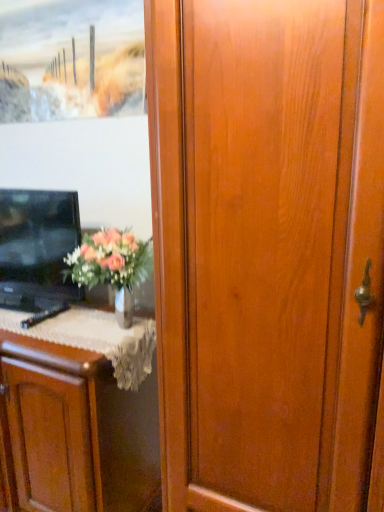
Question: Are matte wood cabinet at left and wooden frame at upper left far apart?

Choices:
 (A) yes
 (B) no

Answer: (A)

Question: Is matte wood cabinet at left to the right of wooden frame at upper left from the viewer's perspective?

Choices:
 (A) yes
 (B) no

Answer: (B)

Question: From the image's perspective, would you say matte wood cabinet at left is positioned over wooden frame at upper left?

Choices:
 (A) yes
 (B) no

Answer: (B)

Question: Does matte wood cabinet at left turn towards wooden frame at upper left?

Choices:
 (A) no
 (B) yes

Answer: (A)

Question: Is matte wood cabinet at left looking in the opposite direction of wooden frame at upper left?

Choices:
 (A) no
 (B) yes

Answer: (A)

Question: From a real-world perspective, is matte wood cabinet at left over wooden frame at upper left?

Choices:
 (A) no
 (B) yes

Answer: (A)

Question: Considering the relative sizes of black glossy tv at left and wooden frame at upper left in the image provided, is black glossy tv at left taller than wooden frame at upper left?

Choices:
 (A) no
 (B) yes

Answer: (B)

Question: Is black glossy tv at left thinner than wooden frame at upper left?

Choices:
 (A) no
 (B) yes

Answer: (A)

Question: Is black glossy tv at left next to wooden frame at upper left and touching it?

Choices:
 (A) no
 (B) yes

Answer: (A)

Question: Does black glossy tv at left have a greater width compared to wooden frame at upper left?

Choices:
 (A) no
 (B) yes

Answer: (B)

Question: Considering the relative sizes of black glossy tv at left and wooden frame at upper left in the image provided, is black glossy tv at left bigger than wooden frame at upper left?

Choices:
 (A) yes
 (B) no

Answer: (A)

Question: Is black glossy tv at left to the right of wooden frame at upper left from the viewer's perspective?

Choices:
 (A) yes
 (B) no

Answer: (B)

Question: From a real-world perspective, is wooden frame at upper left below black glossy tv at left?

Choices:
 (A) yes
 (B) no

Answer: (B)